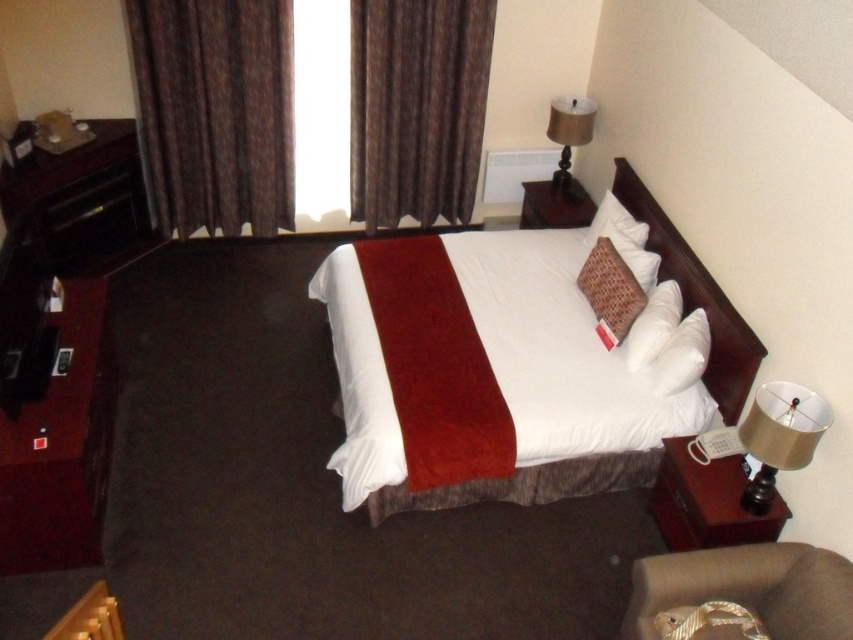
Question: Is brown fabric curtain at upper left smaller than metallic gold lampshade at right?

Choices:
 (A) yes
 (B) no

Answer: (B)

Question: Is brown fabric armchair at lower right positioned in front of white soft bed at center?

Choices:
 (A) yes
 (B) no

Answer: (A)

Question: Among these points, which one is nearest to the camera?

Choices:
 (A) (357, 154)
 (B) (593, 234)
 (C) (714, 372)
 (D) (757, 586)

Answer: (D)

Question: Is brown fabric curtain at upper left to the right of brown fabric armchair at lower right from the viewer's perspective?

Choices:
 (A) yes
 (B) no

Answer: (B)

Question: Which of the following is the farthest from the observer?

Choices:
 (A) white soft bed at center
 (B) brown textured curtain at upper center

Answer: (B)

Question: Which object is closer to the camera taking this photo?

Choices:
 (A) woven fabric pillow at center
 (B) brown fabric curtain at upper left
 (C) brown textured curtain at upper center

Answer: (A)